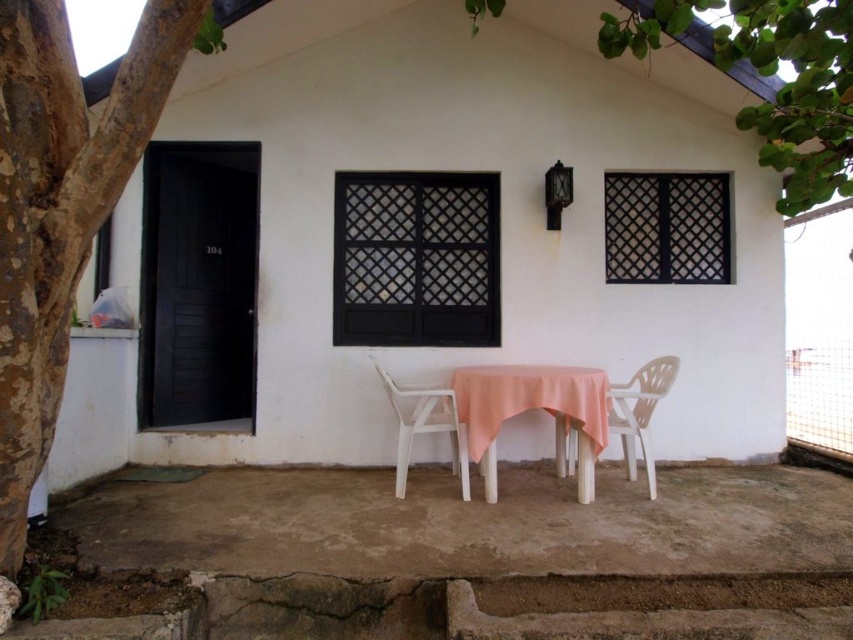
Does smooth brown bark at left have a larger size compared to green leafy tree at upper center?

Incorrect, smooth brown bark at left is not larger than green leafy tree at upper center.

This screenshot has width=853, height=640. Describe the element at coordinates (61, 208) in the screenshot. I see `smooth brown bark at left` at that location.

Locate an element on the screen. smooth brown bark at left is located at coordinates (61, 208).

Can you confirm if smooth brown bark at left is smaller than white plastic chair at lower right?

Actually, smooth brown bark at left might be larger than white plastic chair at lower right.

Can you confirm if smooth brown bark at left is thinner than white plastic chair at lower right?

Incorrect, smooth brown bark at left's width is not less than white plastic chair at lower right's.

Between point (4, 236) and point (650, 458), which one is positioned behind?

Positioned behind is point (650, 458).

The image size is (853, 640). I want to click on smooth brown bark at left, so click(x=61, y=208).

Who is positioned more to the right, green leafy tree at upper center or white plastic chair at lower right?

From the viewer's perspective, green leafy tree at upper center appears more on the right side.

Is green leafy tree at upper center wider than white plastic chair at lower right?

Yes, green leafy tree at upper center is wider than white plastic chair at lower right.

Does point (816, 92) come closer to viewer compared to point (631, 460)?

Yes, point (816, 92) is closer to viewer.

The image size is (853, 640). I want to click on green leafy tree at upper center, so click(798, 92).